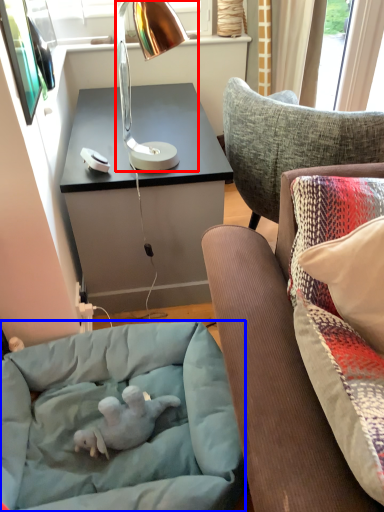
Question: Among these objects, which one is nearest to the camera, lamp (highlighted by a red box) or dog bed (highlighted by a blue box)?

Choices:
 (A) lamp
 (B) dog bed

Answer: (B)